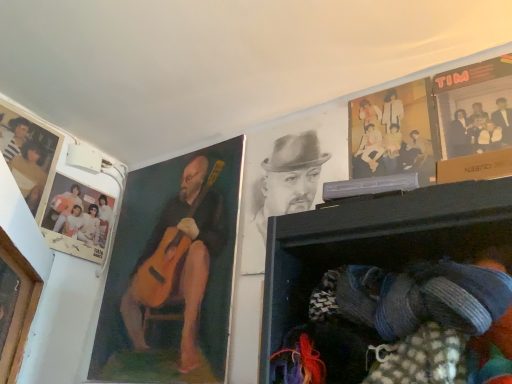
Question: Is wooden guitar at left, the 2th man in the right-to-left sequence, further to the viewer compared to matte paper photo at upper left, placed as the second poster page when sorted from front to back?

Choices:
 (A) yes
 (B) no

Answer: (B)

Question: From the image's perspective, would you say wooden guitar at left, the 2th man in the right-to-left sequence, is shown under matte paper photo at upper left, placed as the second poster page when sorted from front to back?

Choices:
 (A) yes
 (B) no

Answer: (A)

Question: Does wooden guitar at left, which appears as the first man when viewed from the left, appear on the right side of matte paper photo at upper left, which is the second poster page in right-to-left order?

Choices:
 (A) yes
 (B) no

Answer: (A)

Question: From a real-world perspective, is wooden guitar at left, the 2th man in the right-to-left sequence, on matte paper photo at upper left, which is the second poster page in right-to-left order?

Choices:
 (A) yes
 (B) no

Answer: (B)

Question: Is wooden guitar at left, which appears as the first man when viewed from the left, taller than matte paper photo at upper left, placed as the second poster page when sorted from front to back?

Choices:
 (A) yes
 (B) no

Answer: (A)

Question: Considering the positions of wooden guitar at left, which appears as the first man when viewed from the left, and knitted fabric at lower right in the image, is wooden guitar at left, which appears as the first man when viewed from the left, bigger or smaller than knitted fabric at lower right?

Choices:
 (A) small
 (B) big

Answer: (A)

Question: From the image's perspective, is wooden guitar at left, the 2th man in the right-to-left sequence, positioned above or below knitted fabric at lower right?

Choices:
 (A) above
 (B) below

Answer: (A)

Question: Is point (178, 266) closer or farther from the camera than point (358, 263)?

Choices:
 (A) closer
 (B) farther

Answer: (B)

Question: Would you say wooden guitar at left, which appears as the first man when viewed from the left, is inside or outside knitted fabric at lower right?

Choices:
 (A) outside
 (B) inside

Answer: (A)

Question: Which is correct: wooden guitar at left, the 2th man in the right-to-left sequence, is inside matte paper poster at upper right, arranged as the second poster page when viewed from the left, or outside of it?

Choices:
 (A) inside
 (B) outside

Answer: (B)

Question: Relative to matte paper poster at upper right, the second poster page positioned from the back, is wooden guitar at left, which appears as the first man when viewed from the left, in front or behind?

Choices:
 (A) behind
 (B) front

Answer: (A)

Question: From the image's perspective, is wooden guitar at left, the 2th man in the right-to-left sequence, located above or below matte paper poster at upper right, the first poster page in the front-to-back sequence?

Choices:
 (A) below
 (B) above

Answer: (A)

Question: Is point (183, 248) positioned closer to the camera than point (441, 180)?

Choices:
 (A) closer
 (B) farther

Answer: (B)

Question: In terms of width, does wooden frame at left look wider or thinner when compared to matte plastic picture frame at upper left?

Choices:
 (A) wide
 (B) thin

Answer: (B)

Question: From the image's perspective, is wooden frame at left positioned above or below matte plastic picture frame at upper left?

Choices:
 (A) above
 (B) below

Answer: (B)